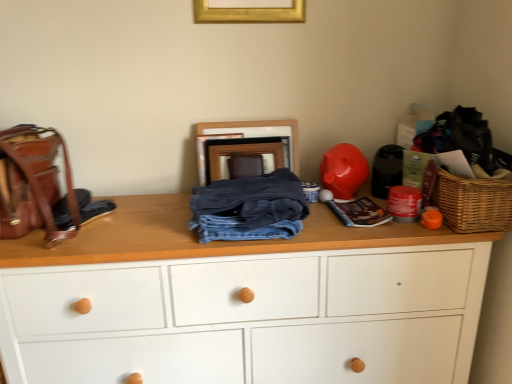
Question: Visually, is gold metallic picture frame at upper center, acting as the 1th picture frame starting from the top, positioned to the left or to the right of wooden picture frame at center, placed as the second picture frame when sorted from front to back?

Choices:
 (A) right
 (B) left

Answer: (A)

Question: Is gold metallic picture frame at upper center, positioned as the 2th picture frame in bottom-to-top order, bigger or smaller than wooden picture frame at center, the 1th picture frame from the bottom?

Choices:
 (A) small
 (B) big

Answer: (A)

Question: Based on their relative distances, which object is farther from the denim fabric pants at center?

Choices:
 (A) shiny plastic piggy bank at right
 (B) wooden picture frame at center, the 1th picture frame from the bottom
 (C) white painted wood chest of drawers at center
 (D) gold metallic picture frame at upper center, which appears as the first picture frame when viewed from the front
 (E) leather backpack at left

Answer: (D)

Question: Which object is the closest to the woven brown picnic basket at right?

Choices:
 (A) wooden picture frame at center, placed as the second picture frame when sorted from front to back
 (B) gold metallic picture frame at upper center, positioned as the 2th picture frame in bottom-to-top order
 (C) leather backpack at left
 (D) white painted wood chest of drawers at center
 (E) shiny plastic piggy bank at right

Answer: (E)